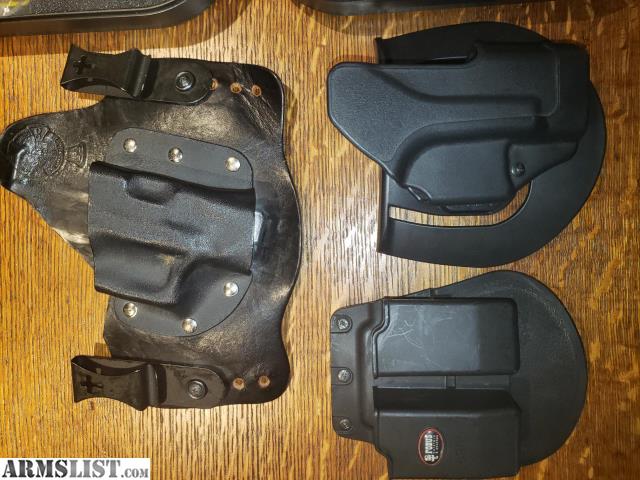
You are a GUI agent. You are given a task and a screenshot of the screen. Output one action in this format:
    pyautogui.click(x=<x>, y=<y>)
    Task: Click on the picture of gun holsters on a table
    
    Given the screenshot: What is the action you would take?
    pyautogui.click(x=338, y=182)